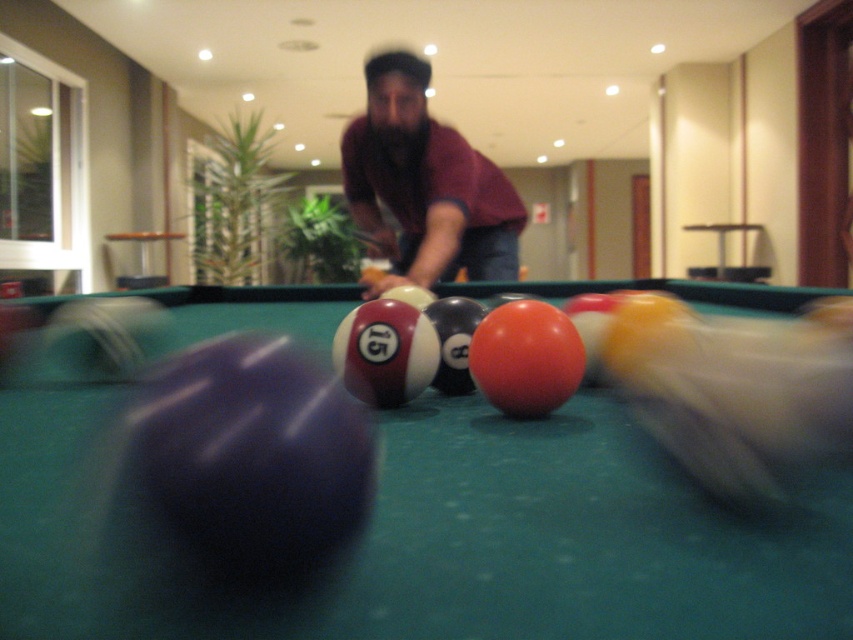
You are standing in the room and see the smooth green pool table at center and the maroon shirt at center. Which object is positioned to the left of the other?

The smooth green pool table at center is to the left of maroon shirt at center.

You are a photographer trying to capture the action of the pool game. Given the scene, which object, the smooth green pool table at center or the maroon shirt at center, would you focus on to ensure the subject with the larger size in the frame is captured?

The maroon shirt at center is larger in the frame than the smooth green pool table at center, so focusing on the maroon shirt at center would capture the larger subject.

You are standing at the center of the room. Where is the smooth green pool table at center located relative to your position?

The smooth green pool table at center is located at point 0.841 on the x axis and 0.538 on the y axis relative to your position.